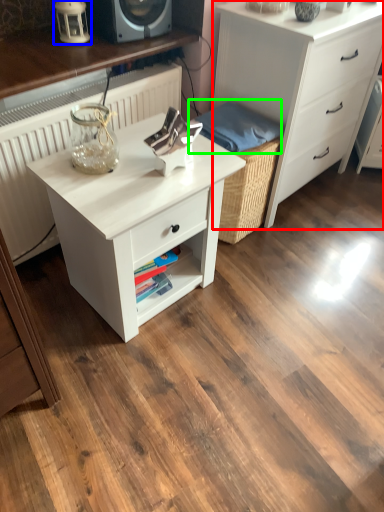
Question: Based on their relative distances, which object is farther from chest of drawers (highlighted by a red box)? Choose from table lamp (highlighted by a blue box) and material (highlighted by a green box).

Choices:
 (A) table lamp
 (B) material

Answer: (A)